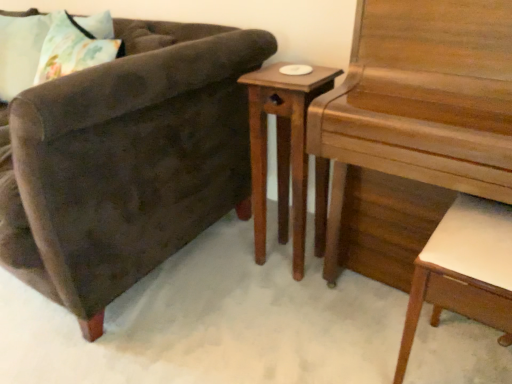
At what (x,y) coordinates should I click in order to perform the action: click on empty space that is in between white leather desk at lower right and wooden piano at right. Please return your answer as a coordinate pair (x, y). The width and height of the screenshot is (512, 384). Looking at the image, I should click on (354, 348).